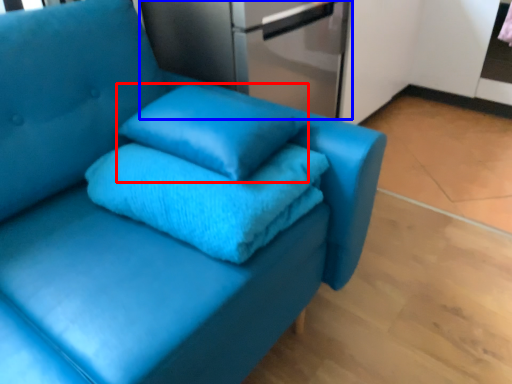
Question: Which object appears closest to the camera in this image, pillow (highlighted by a red box) or appliance (highlighted by a blue box)?

Choices:
 (A) pillow
 (B) appliance

Answer: (A)